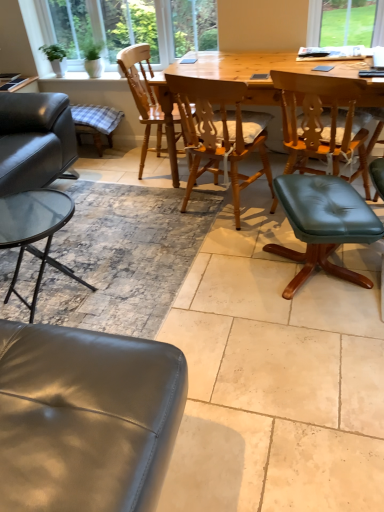
Question: Is point (291, 105) positioned closer to the camera than point (309, 218)?

Choices:
 (A) farther
 (B) closer

Answer: (A)

Question: Choose the correct answer: Is green leather stool at center, the 1th chair positioned from the right, inside teal leather stool at center-right, positioned as the 2th bar stool in back-to-front order, or outside it?

Choices:
 (A) outside
 (B) inside

Answer: (A)

Question: Which is nearer to the wooden frame at upper left?

Choices:
 (A) green leather stool at center, the 1th chair positioned from the right
 (B) wooden chair at center, the second chair in the right-to-left sequence
 (C) wooden chair at center, which is the 3th chair from right to left
 (D) natural wood table at center
 (E) plaid fabric cushion at left, which is the 1th bar stool from top to bottom

Answer: (E)

Question: Estimate the real-world distances between objects in this image. Which object is farther from the teal leather stool at center-right, positioned as the 2th bar stool in back-to-front order?

Choices:
 (A) plaid fabric cushion at left, the 1th bar stool positioned from the back
 (B) green leather stool at center, the 1th chair positioned from the right
 (C) wooden frame at upper left
 (D) wooden chair at center, the second chair in the right-to-left sequence
 (E) natural wood table at center

Answer: (C)